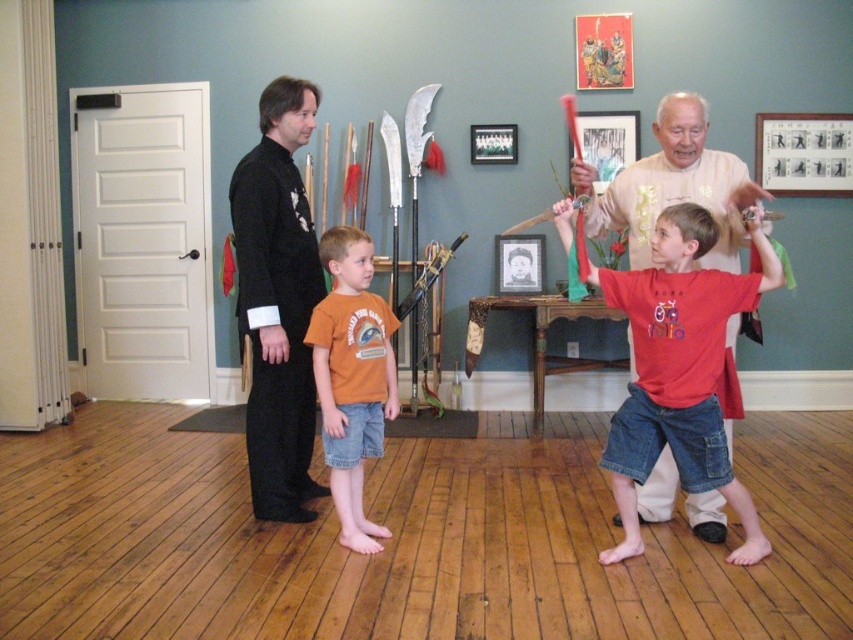
You are standing in the room and want to reach the point marked at coordinates (341, 272). If you take a step forward of 1.5 meters, will you be closer to or farther from that point?

The point marked at coordinates (341, 272) is 2.88 meters from the viewer. Taking a step forward of 1.5 meters would bring you to 1.38 meters away, so you would be closer to the point.